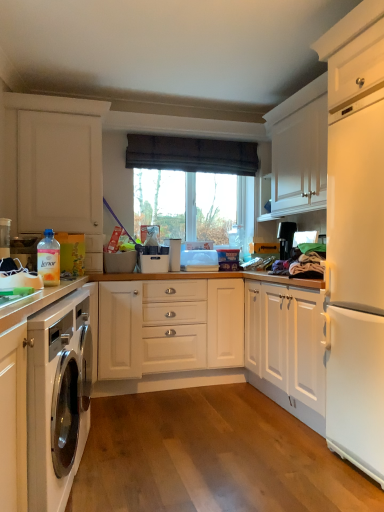
Question: Visually, is black plastic coffee maker at upper right positioned to the left or to the right of white matte cabinet at left, the second cabinetry when ordered from bottom to top?

Choices:
 (A) left
 (B) right

Answer: (B)

Question: In terms of size, does black plastic coffee maker at upper right appear bigger or smaller than white matte cabinet at left, the second cabinetry when ordered from bottom to top?

Choices:
 (A) big
 (B) small

Answer: (B)

Question: Which of these objects is positioned closest to the translucent plastic bottle at lower left?

Choices:
 (A) transparent glass window at center
 (B) dark brown fabric at upper center
 (C) black plastic coffee maker at upper right
 (D) white glossy cabinet at lower left, positioned as the first cabinetry in bottom-to-top order
 (E) white matte cabinet at left, the second cabinetry when ordered from bottom to top

Answer: (D)

Question: Considering the real-world distances, which object is closest to the translucent plastic bottle at lower left?

Choices:
 (A) black plastic coffee maker at upper right
 (B) transparent glass window at center
 (C) white glossy cabinet at lower left, the second cabinetry viewed from the back
 (D) white matte cabinet at left, marked as the 1th cabinetry in a back-to-front arrangement
 (E) dark brown fabric at upper center

Answer: (C)